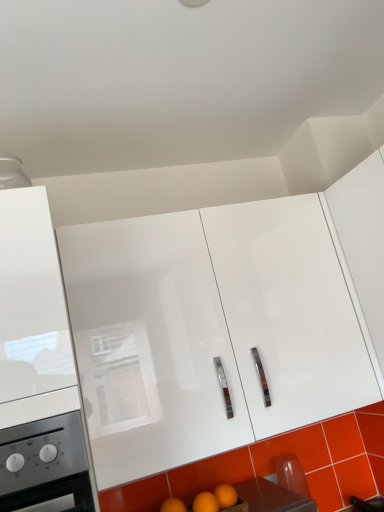
Question: Is point (221, 414) closer or farther from the camera than point (339, 462)?

Choices:
 (A) farther
 (B) closer

Answer: (B)

Question: Considering the positions of white glossy cabinet at center, placed as the 2th cabinetry when sorted from right to left, and orange glossy tile at lower right in the image, is white glossy cabinet at center, placed as the 2th cabinetry when sorted from right to left, taller or shorter than orange glossy tile at lower right?

Choices:
 (A) tall
 (B) short

Answer: (A)

Question: Which of these objects is positioned farthest from the white glossy cabinet at center, which is the second cabinetry in left-to-right order?

Choices:
 (A) orange glossy tile at lower right
 (B) white glossy cabinet at upper right, acting as the 1th cabinetry starting from the right
 (C) white glossy cabinet at left, the 1th cabinetry positioned from the left
 (D) orange matte wood at lower center

Answer: (A)

Question: Estimate the real-world distances between objects in this image. Which object is farther from the white glossy cabinet at left, the 3th cabinetry positioned from the right?

Choices:
 (A) orange glossy tile at lower right
 (B) orange matte wood at lower center
 (C) white glossy cabinet at upper right, the third cabinetry when ordered from left to right
 (D) white glossy cabinet at center, which is the second cabinetry in left-to-right order

Answer: (A)